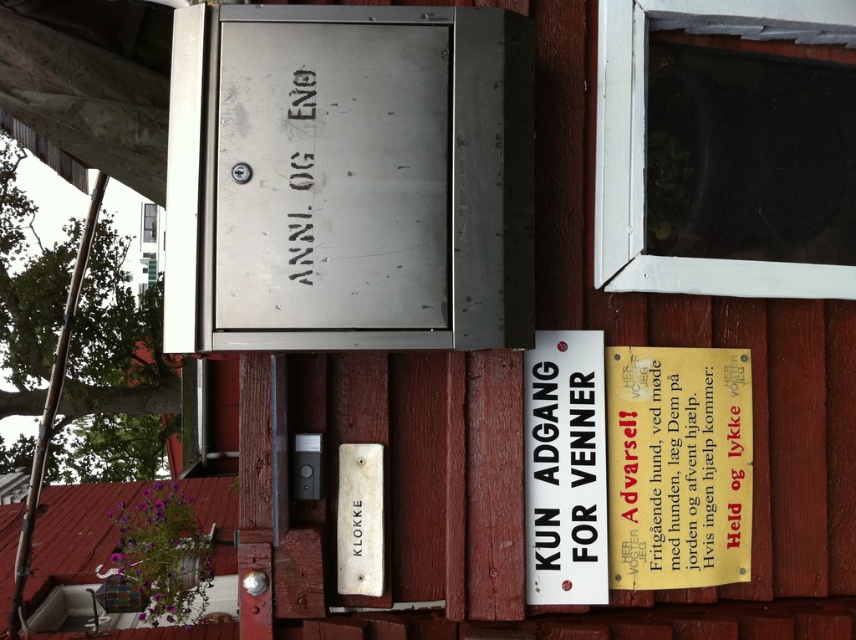
Question: Which point is farther to the camera?

Choices:
 (A) metallic warning sign at right
 (B) black metallic text at upper center

Answer: (A)

Question: Is white plastic sign at center below black metallic text at upper center?

Choices:
 (A) yes
 (B) no

Answer: (A)

Question: Which is nearer to the metallic warning sign at right?

Choices:
 (A) black metallic text at upper center
 (B) white plastic sign at center

Answer: (B)

Question: Among these objects, which one is farthest from the camera?

Choices:
 (A) metallic warning sign at right
 (B) black metallic text at upper center
 (C) white plastic sign at center

Answer: (A)

Question: Can you confirm if metallic warning sign at right is bigger than black metallic text at upper center?

Choices:
 (A) no
 (B) yes

Answer: (B)

Question: Does metallic warning sign at right appear on the left side of black metallic text at upper center?

Choices:
 (A) no
 (B) yes

Answer: (A)